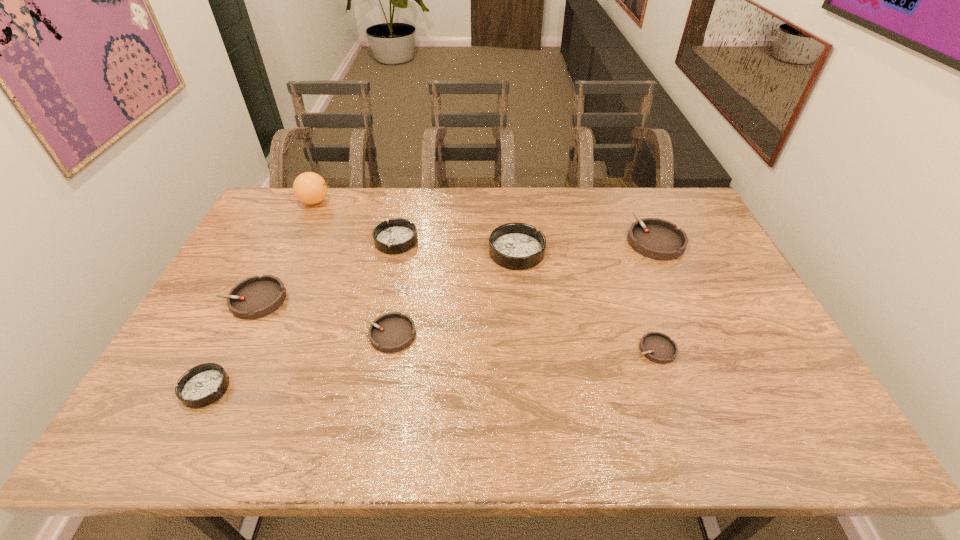
The image size is (960, 540). In order to click on the shortest object in this screenshot , I will do `click(657, 347)`.

The image size is (960, 540). In order to click on the smallest gray ashtray in this screenshot , I will do `click(657, 347)`.

Find the location of a particular element. vacant space located on the side with brand of the ping-pong ball is located at coordinates (406, 202).

The image size is (960, 540). Identify the location of free space located 0.300m on the front of the farthest gray ashtray. [698, 336].

Identify the location of vacant space located on the right of the biggest dark ashtray. (597, 252).

Where is `free location located 0.260m on the back of the third smallest gray ashtray`? The height and width of the screenshot is (540, 960). free location located 0.260m on the back of the third smallest gray ashtray is located at coordinates (290, 228).

Locate an element on the screen. vacant space located 0.310m on the right of the second dark ashtray from left to right is located at coordinates (512, 241).

Locate an element on the screen. free space located on the front of the third biggest gray ashtray is located at coordinates (379, 395).

This screenshot has width=960, height=540. Find the location of `vacant space located on the back of the smallest dark ashtray`. vacant space located on the back of the smallest dark ashtray is located at coordinates (249, 305).

Locate an element on the screen. blank space located 0.170m on the right of the smallest gray ashtray is located at coordinates (741, 349).